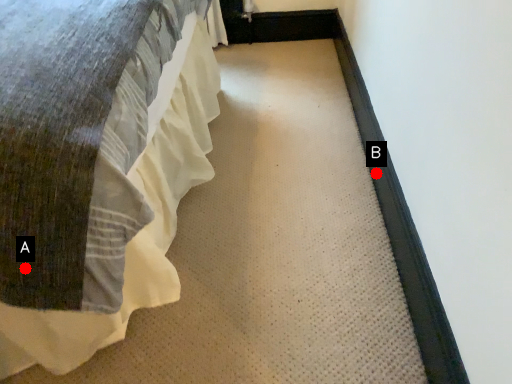
Question: Two points are circled on the image, labeled by A and B beside each circle. Which point appears farthest from the camera in this image?

Choices:
 (A) A is further
 (B) B is further

Answer: (B)